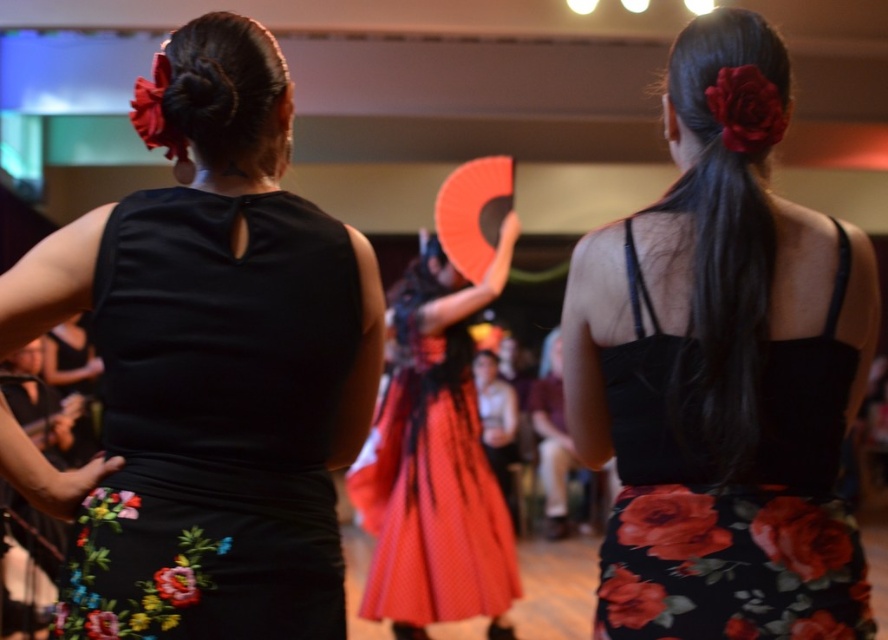
Question: Considering the real-world distances, which object is farthest from the dark brown silky hair bun at upper left?

Choices:
 (A) floral fabric dress at center
 (B) black satin dress at center

Answer: (A)

Question: Does red dotted fabric dress at center have a larger size compared to black silky hair at upper center?

Choices:
 (A) yes
 (B) no

Answer: (A)

Question: Which object appears closest to the camera in this image?

Choices:
 (A) red dotted fabric dress at center
 (B) floral fabric dress at center
 (C) black satin dress at center

Answer: (C)

Question: Can you confirm if floral fabric dress at center is smaller than black silky hair at upper center?

Choices:
 (A) yes
 (B) no

Answer: (B)

Question: Which point is closer to the camera?

Choices:
 (A) (258, 72)
 (B) (62, 262)
 (C) (395, 404)

Answer: (B)

Question: Is black satin dress at center behind black silky hair at upper center?

Choices:
 (A) no
 (B) yes

Answer: (A)